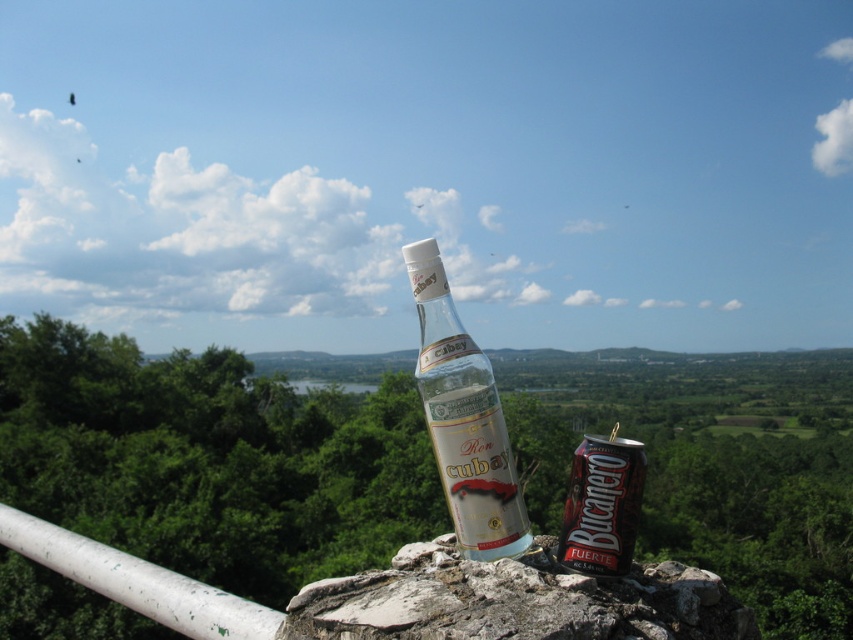
You are standing at the stone ledge in the scene. There is a clear glass bottle at center marked by point (x=463, y=419). If you were to pour water from the bottle into the body of water in the midground, would the bottle sink or float?

The clear glass bottle at center marked by point (x=463, y=419) is made of glass, which is denser than water. Therefore, if you pour water from the bottle into the body of water in the midground, the bottle would sink.

You are planning to pack these items into a rectangular box that can only accommodate items with a combined width of up to 20 cm. If the clear glass bottle at center is 12 cm wide and the metallic silver can at center is 8 cm wide, will both items fit together in the box?

The clear glass bottle at center is 12 cm wide and the metallic silver can at center is 8 cm wide. Their combined width is 20 cm, which exactly matches the box capacity. Therefore, both items will fit together in the box.

You are a photographer standing in front of the stone ledge with the clear glass bottle at center and the metallic silver can at center. You want to take a photo where both items are in focus. Which item should you focus on to ensure both are sharp?

You should focus on the metallic silver can at center because it is farther away from you than the clear glass bottle at center. By focusing on the farther object, the depth of field will include both items in sharp focus.